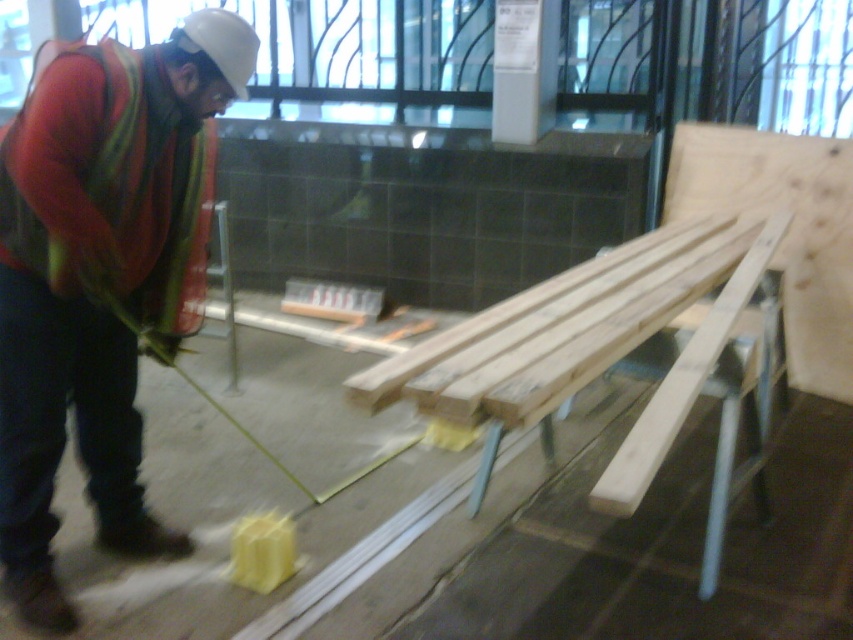
Is orange safety vest at left further to the viewer compared to light brown wood at upper right?

No.

From the picture: Measure the distance between point (54, 125) and camera.

Point (54, 125) and camera are 5.79 feet apart.

Locate an element on the screen. orange safety vest at left is located at coordinates (91, 275).

Measure the distance between orange safety vest at left and camera.

orange safety vest at left is 5.74 feet from camera.

Does orange safety vest at left have a smaller size compared to natural wood at center?

Indeed, orange safety vest at left has a smaller size compared to natural wood at center.

Where is `orange safety vest at left`? The height and width of the screenshot is (640, 853). orange safety vest at left is located at coordinates (91, 275).

From the picture: Is natural wood at center behind light brown wood at upper right?

That is False.

Does natural wood at center have a greater width compared to light brown wood at upper right?

Correct, the width of natural wood at center exceeds that of light brown wood at upper right.

Is point (747, 294) positioned in front of point (735, 141)?

Yes, it is.

Locate an element on the screen. natural wood at center is located at coordinates (589, 340).